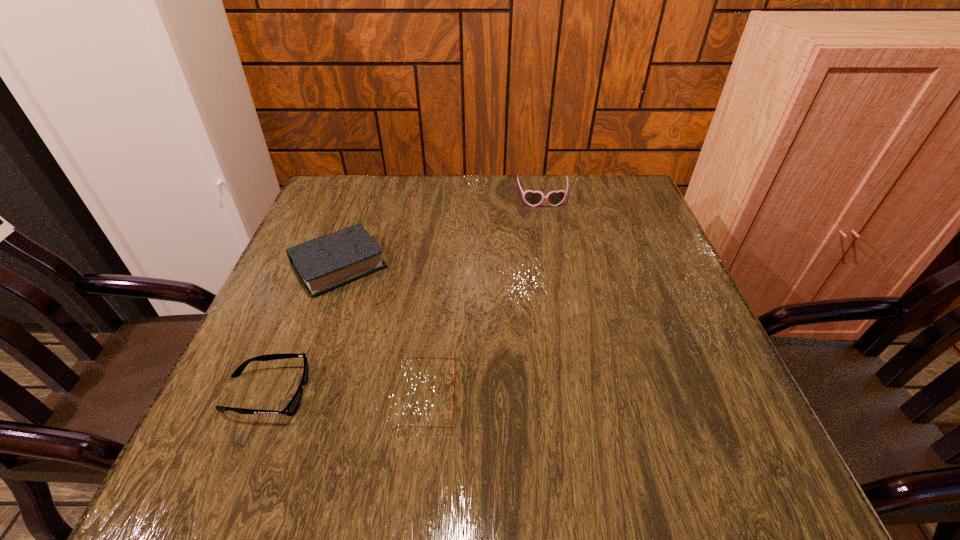
Where is `the rightmost object`? The height and width of the screenshot is (540, 960). the rightmost object is located at coordinates (533, 198).

Find the location of a particular element. the farthest object is located at coordinates (533, 198).

The height and width of the screenshot is (540, 960). What are the coordinates of `Bible` in the screenshot? It's located at (324, 263).

Locate an element on the screen. the third object from left to right is located at coordinates (451, 426).

Identify the location of the leftmost sunglasses. (290, 409).

The image size is (960, 540). I want to click on vacant space situated on the front-facing side of the rightmost object, so click(x=551, y=246).

At what (x,y) coordinates should I click in order to perform the action: click on free space located on the back of the Bible. Please return your answer as a coordinate pair (x, y). Looking at the image, I should click on (368, 185).

Where is `blank area located on the face of the second sunglasses from left to right`? blank area located on the face of the second sunglasses from left to right is located at coordinates click(x=596, y=397).

This screenshot has height=540, width=960. In order to click on vacant space situated on the front-facing side of the leftmost sunglasses in this screenshot , I will do `click(488, 393)`.

You are a GUI agent. You are given a task and a screenshot of the screen. Output one action in this format:
    pyautogui.click(x=<x>, y=<y>)
    Task: Click on the object positioned at the far edge
    The image size is (960, 540).
    Given the screenshot: What is the action you would take?
    pyautogui.click(x=533, y=198)